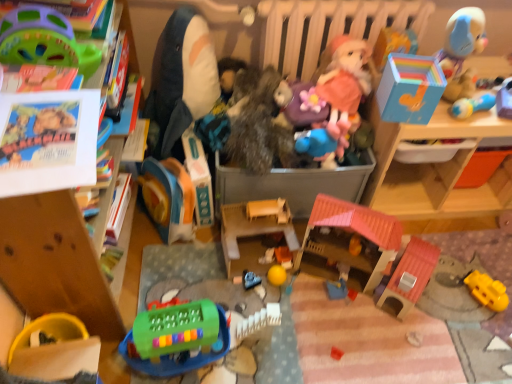
The image size is (512, 384). I want to click on vacant space in front of wooden farm at center, which is counted as the 9th toy, starting from the right, so coord(261,304).